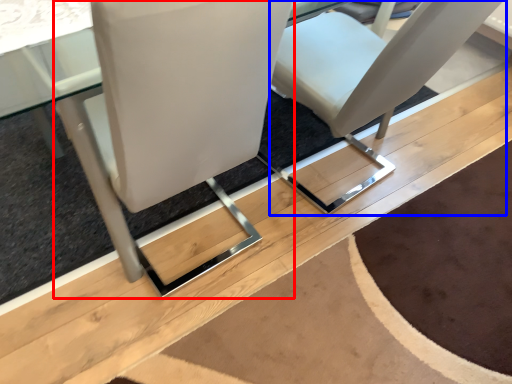
Question: Which point is closer to the camera, chair (highlighted by a red box) or chair (highlighted by a blue box)?

Choices:
 (A) chair
 (B) chair

Answer: (A)